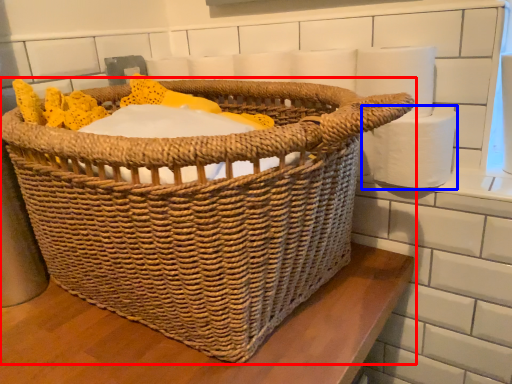
Question: Which point is closer to the camera, picnic basket (highlighted by a red box) or toilet paper (highlighted by a blue box)?

Choices:
 (A) picnic basket
 (B) toilet paper

Answer: (A)